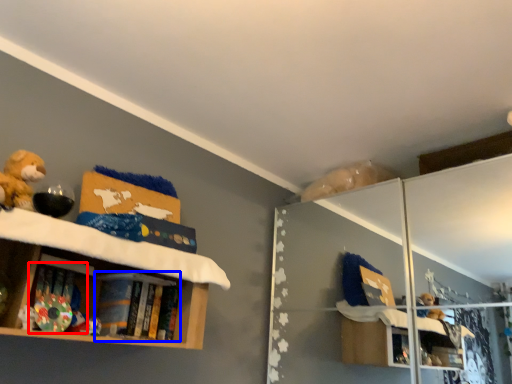
Question: Which point is closer to the camera, book (highlighted by a red box) or book (highlighted by a blue box)?

Choices:
 (A) book
 (B) book

Answer: (A)